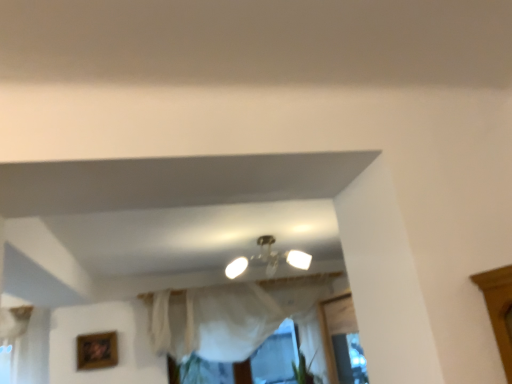
Question: Is wooden picture frame at lower left aimed at green leafy plant at lower center?

Choices:
 (A) yes
 (B) no

Answer: (B)

Question: Is wooden picture frame at lower left next to green leafy plant at lower center and touching it?

Choices:
 (A) yes
 (B) no

Answer: (B)

Question: Is wooden picture frame at lower left positioned before green leafy plant at lower center?

Choices:
 (A) yes
 (B) no

Answer: (A)

Question: Is green leafy plant at lower center surrounded by wooden picture frame at lower left?

Choices:
 (A) no
 (B) yes

Answer: (A)

Question: Can you confirm if wooden picture frame at lower left is shorter than green leafy plant at lower center?

Choices:
 (A) no
 (B) yes

Answer: (A)

Question: Based on their positions, is white sheer curtain at center located to the left or right of wooden picture frame at lower left?

Choices:
 (A) left
 (B) right

Answer: (B)

Question: From a real-world perspective, is white sheer curtain at center above or below wooden picture frame at lower left?

Choices:
 (A) above
 (B) below

Answer: (B)

Question: Looking at the image, does white sheer curtain at center seem bigger or smaller compared to wooden picture frame at lower left?

Choices:
 (A) small
 (B) big

Answer: (B)

Question: Is white sheer curtain at center inside the boundaries of wooden picture frame at lower left, or outside?

Choices:
 (A) inside
 (B) outside

Answer: (B)

Question: Visually, is wooden picture frame at lower left positioned to the left or to the right of green leafy plant at lower center?

Choices:
 (A) right
 (B) left

Answer: (B)

Question: Considering the positions of wooden picture frame at lower left and green leafy plant at lower center in the image, is wooden picture frame at lower left wider or thinner than green leafy plant at lower center?

Choices:
 (A) wide
 (B) thin

Answer: (B)

Question: Is wooden picture frame at lower left spatially inside green leafy plant at lower center, or outside of it?

Choices:
 (A) outside
 (B) inside

Answer: (A)

Question: Is wooden picture frame at lower left in front of or behind green leafy plant at lower center in the image?

Choices:
 (A) front
 (B) behind

Answer: (A)

Question: Is wooden picture frame at lower left to the left or to the right of white sheer curtain at center in the image?

Choices:
 (A) left
 (B) right

Answer: (A)

Question: Is wooden picture frame at lower left taller or shorter than white sheer curtain at center?

Choices:
 (A) tall
 (B) short

Answer: (B)